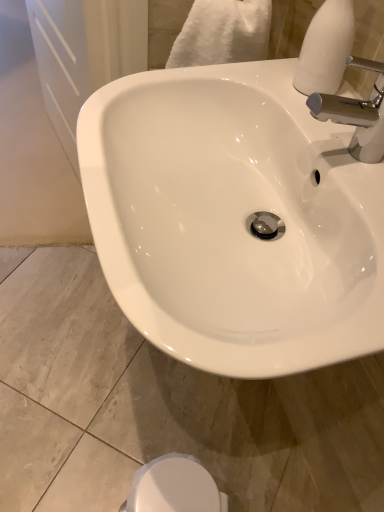
The height and width of the screenshot is (512, 384). I want to click on free space between white matte soap dispenser at upper right and chrome metallic faucet at upper right, so click(324, 117).